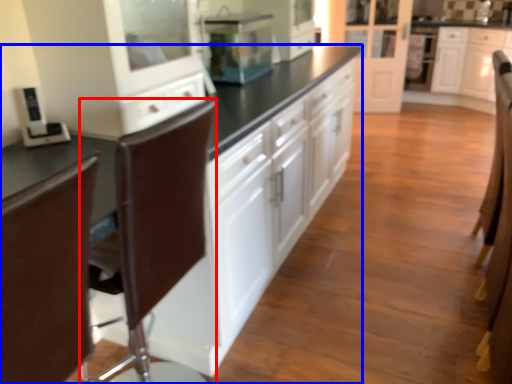
Question: Which point is further to the camera, swivel chair (highlighted by a red box) or cabinetry (highlighted by a blue box)?

Choices:
 (A) swivel chair
 (B) cabinetry

Answer: (B)